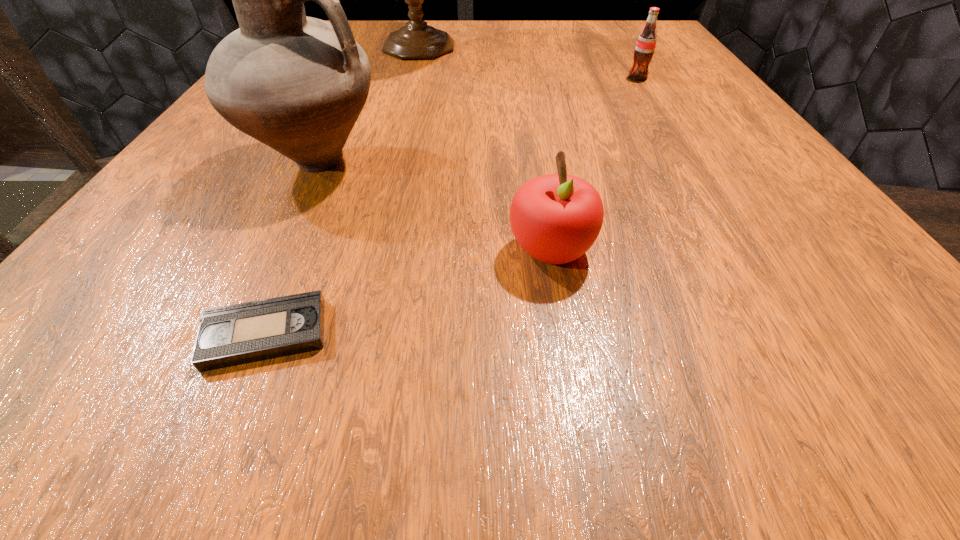
Where is `object situated at the near left corner`? object situated at the near left corner is located at coordinates (236, 334).

I want to click on vacant space at the far edge of the desktop, so click(524, 37).

I want to click on free space at the near edge of the desktop, so click(481, 323).

Identify the location of vacant region at the left edge. (267, 214).

This screenshot has width=960, height=540. In order to click on vacant space at the right edge of the desktop in this screenshot , I will do `click(641, 117)`.

The height and width of the screenshot is (540, 960). In the image, there is a desktop. Find the location of `vacant space at the far left corner`. vacant space at the far left corner is located at coordinates (366, 28).

Locate an element on the screen. This screenshot has width=960, height=540. vacant space at the near left corner of the desktop is located at coordinates (109, 326).

The image size is (960, 540). I want to click on free space between the second tallest object and the tallest object, so [x=368, y=105].

Find the location of a particular element. The height and width of the screenshot is (540, 960). vacant point located between the second nearest object and the rightmost object is located at coordinates (594, 164).

Find the location of a particular element. Image resolution: width=960 pixels, height=540 pixels. free spot between the tallest object and the second nearest object is located at coordinates (485, 150).